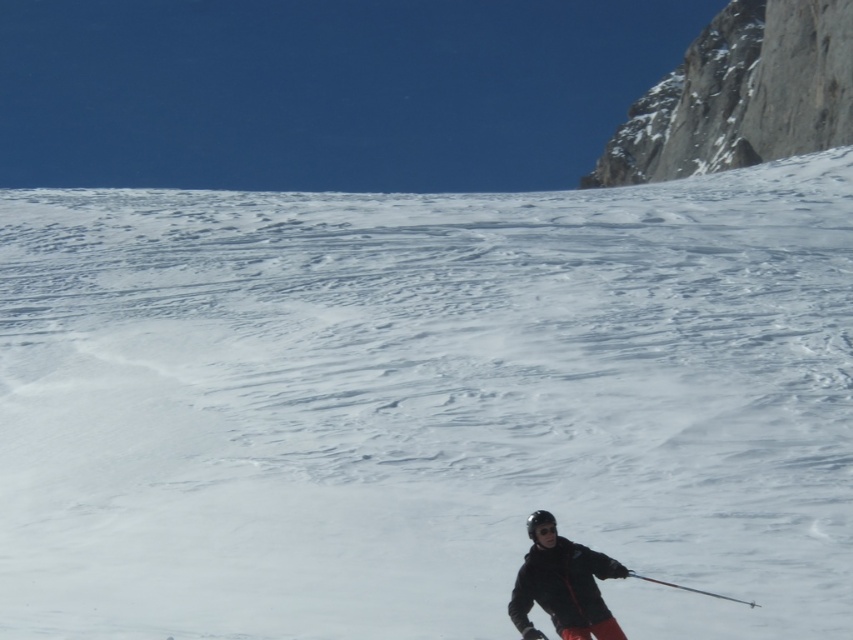
Is rocky cliff at upper right positioned in front of black matte jacket at lower right?

No.

Which is in front, point (846, 132) or point (567, 554)?

Point (567, 554) is in front.

Identify the location of rocky cliff at upper right. (741, 93).